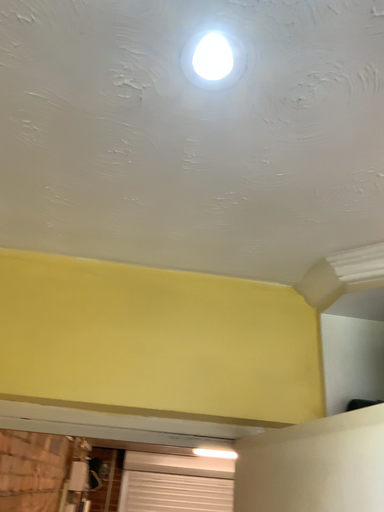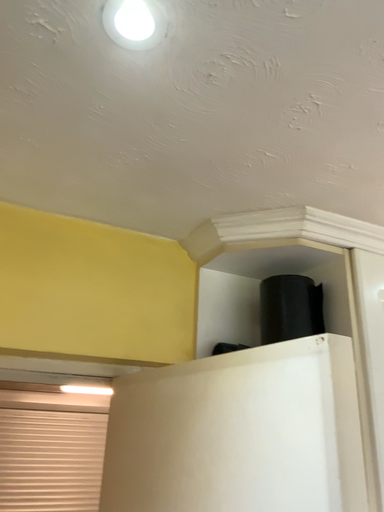
Question: How did the camera likely rotate when shooting the video?

Choices:
 (A) rotated left
 (B) rotated right

Answer: (B)